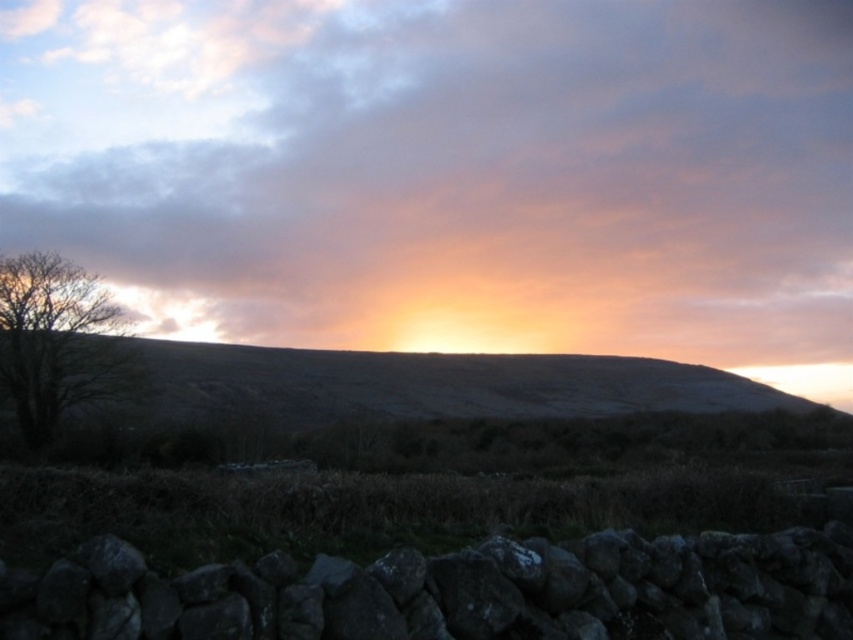
Which is more to the left, cloudy sky at upper center or brown leafless tree at left?

brown leafless tree at left is more to the left.

Does point (753, 44) come closer to viewer compared to point (44, 353)?

No, (753, 44) is further to viewer.

Locate an element on the screen. Image resolution: width=853 pixels, height=640 pixels. cloudy sky at upper center is located at coordinates (445, 170).

You are a GUI agent. You are given a task and a screenshot of the screen. Output one action in this format:
    pyautogui.click(x=<x>, y=<y>)
    Task: Click on the cloudy sky at upper center
    This screenshot has height=640, width=853.
    Given the screenshot: What is the action you would take?
    pyautogui.click(x=445, y=170)